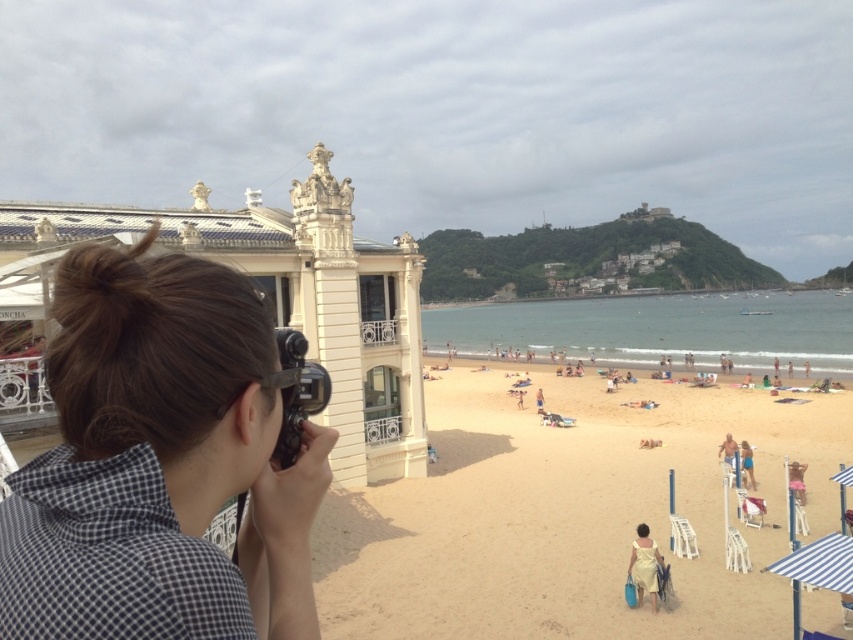
Is yellow fabric dress at lower right positioned behind beige fabric towel at lower right?

No, yellow fabric dress at lower right is in front of beige fabric towel at lower right.

Which is in front, point (654, 564) or point (750, 449)?

Point (654, 564)

Between point (657, 557) and point (744, 467), which one is positioned behind?

Positioned behind is point (744, 467).

You are a GUI agent. You are given a task and a screenshot of the screen. Output one action in this format:
    pyautogui.click(x=<x>, y=<y>)
    Task: Click on the yellow fabric dress at lower right
    This screenshot has width=853, height=640.
    Given the screenshot: What is the action you would take?
    pyautogui.click(x=645, y=564)

Can you confirm if golden sand beach at center is thinner than black plastic camera at center?

Incorrect, golden sand beach at center's width is not less than black plastic camera at center's.

Between golden sand beach at center and black plastic camera at center, which one is positioned higher?

black plastic camera at center is above.

Is point (521, 444) farther from camera compared to point (311, 410)?

Yes, point (521, 444) is behind point (311, 410).

Find the location of a particular element. golden sand beach at center is located at coordinates (570, 515).

Between point (111, 628) and point (297, 445), which one is positioned in front?

Positioned in front is point (111, 628).

Does point (260, 580) come closer to viewer compared to point (281, 328)?

Yes, point (260, 580) is closer to viewer.

What are the coordinates of `checkered fabric hair at center` in the screenshot? It's located at pyautogui.click(x=160, y=464).